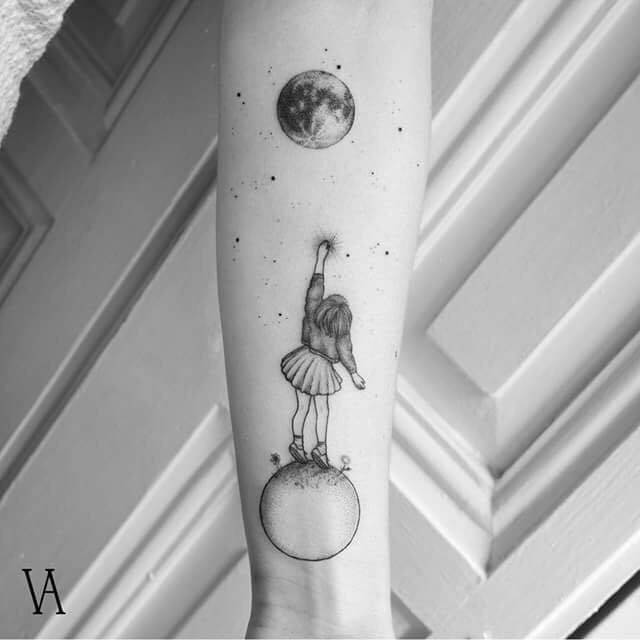
Image resolution: width=640 pixels, height=640 pixels. I want to click on spot between door and door frame, so click(x=625, y=595).